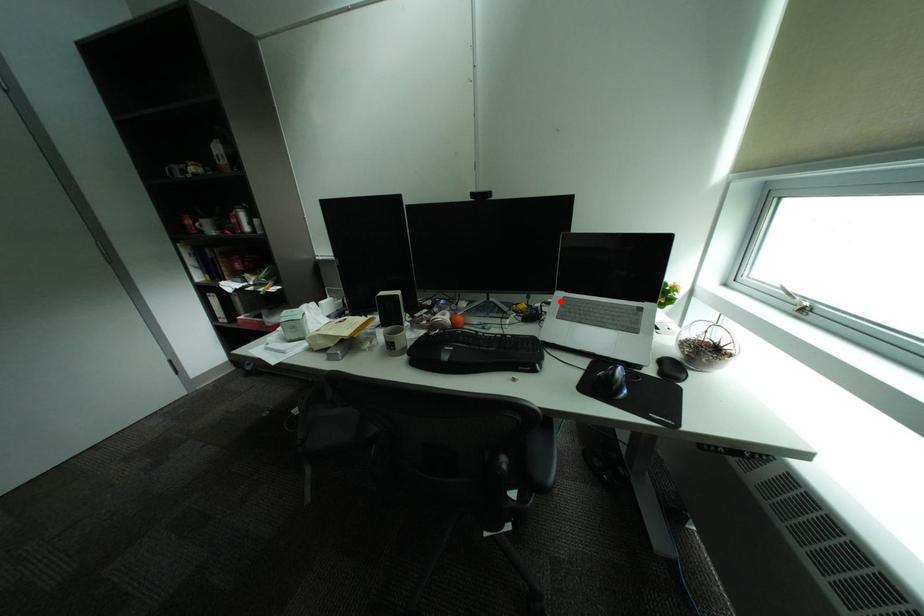
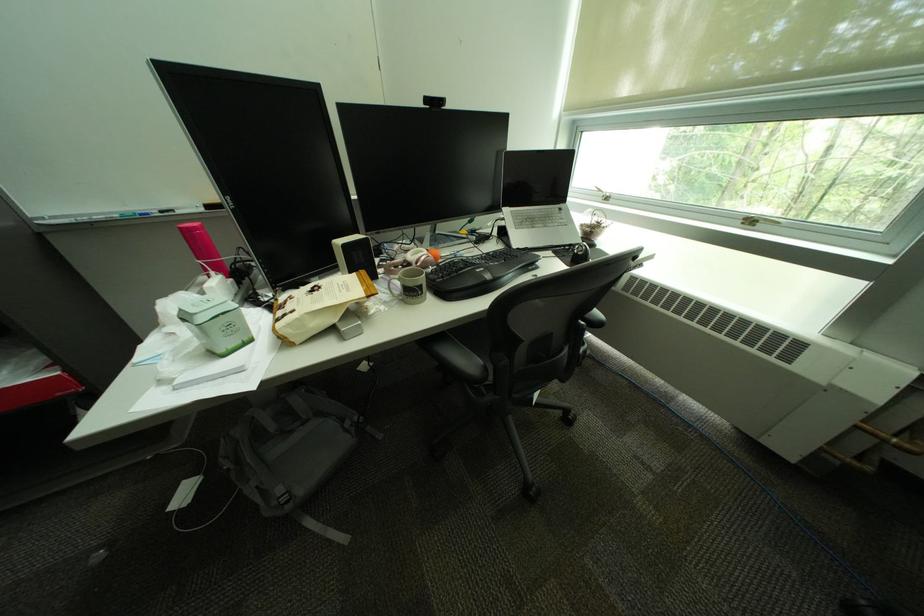
Find the pixel in the second image that matches the highlighted location in the first image.

(514, 217)